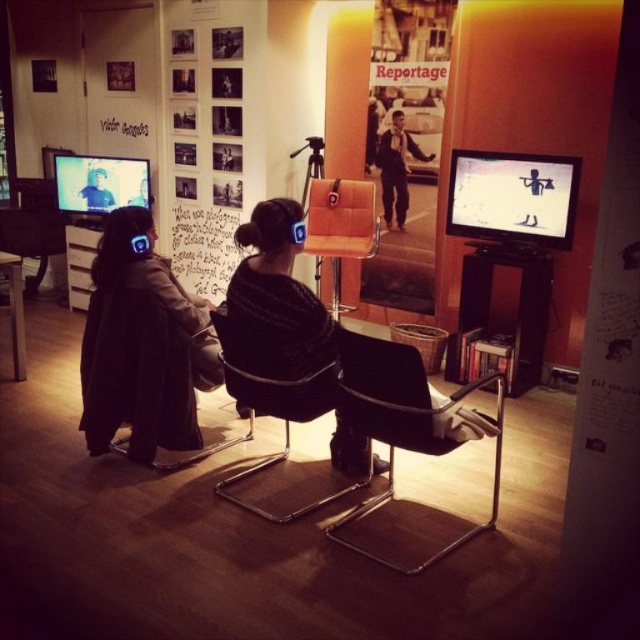
Question: Estimate the real-world distances between objects in this image. Which object is closer to the light brown leather jacket at center?

Choices:
 (A) matte black chair at center
 (B) white matte screen at right

Answer: (B)

Question: Does dark brown leather jacket at left have a larger size compared to white matte screen at right?

Choices:
 (A) yes
 (B) no

Answer: (A)

Question: Which point appears closest to the camera in this image?

Choices:
 (A) (262, 516)
 (B) (353, 237)
 (C) (400, 112)
 (D) (113, 204)

Answer: (A)

Question: Is dark brown leather jacket at left positioned at the back of matte black chair at center?

Choices:
 (A) no
 (B) yes

Answer: (B)

Question: Which of the following is the farthest from the observer?

Choices:
 (A) (339, 202)
 (B) (394, 372)

Answer: (A)

Question: Is matte black chair at center thinner than black leather armchair at center?

Choices:
 (A) yes
 (B) no

Answer: (A)